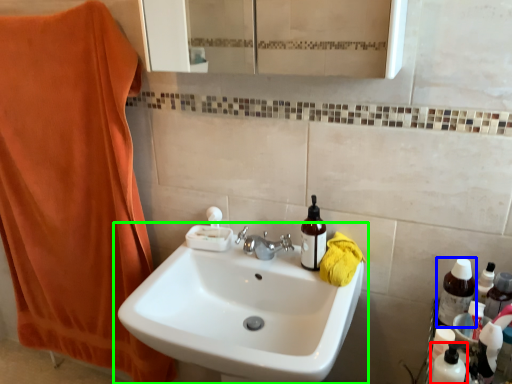
Question: Estimate the real-world distances between objects in this image. Which object is closer to cleaning product (highlighted by a red box), bottle (highlighted by a blue box) or sink (highlighted by a green box)?

Choices:
 (A) bottle
 (B) sink

Answer: (A)